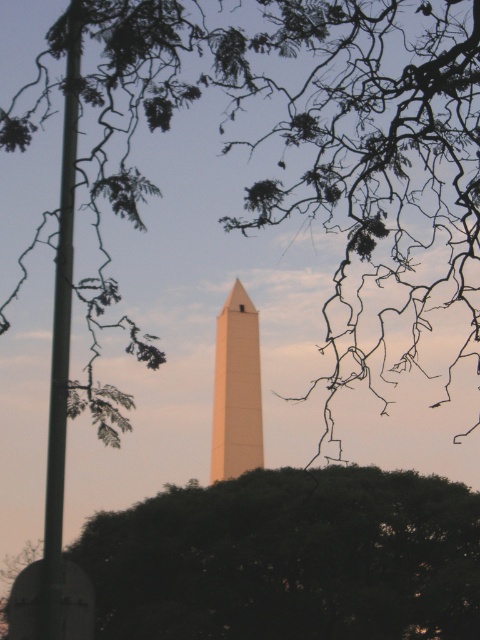
Looking at this image, you are standing in a park and see the green leafy tree at upper center and the green leafy tree at center. Which tree is closer to you?

The green leafy tree at upper center is closer to you because it is positioned in front of the green leafy tree at center.

You are an architect designing a new park layout. You want to place a bench so that visitors can see the smooth beige obelisk at center without obstruction from the green leafy tree at upper center. Based on the scene description, where should you position the bench?

The green leafy tree at upper center is larger than the smooth beige obelisk at center. To ensure an unobstructed view of the obelisk, place the bench in a position where the tree does not block the line of sight to the obelisk. Since the tree is at upper center, positioning the bench slightly to the side or behind the tree might provide a clear view of the smooth beige obelisk at center.